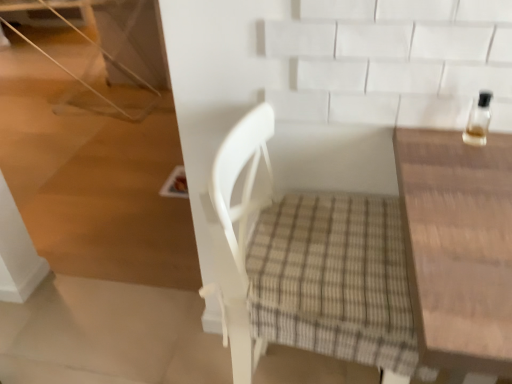
The width and height of the screenshot is (512, 384). Find the location of `free space to the left of clear glass bottle at upper right`. free space to the left of clear glass bottle at upper right is located at coordinates (426, 149).